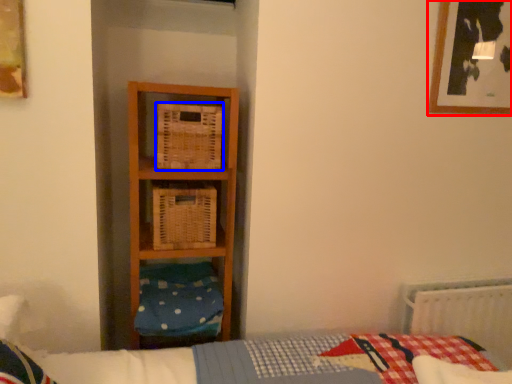
Question: Which of the following is the closest to the observer, picture frame (highlighted by a red box) or crate (highlighted by a blue box)?

Choices:
 (A) picture frame
 (B) crate

Answer: (B)